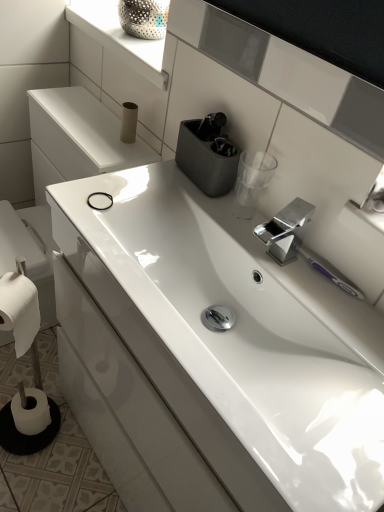
Where is `free location in front of matte cardboard toilet paper at upper center, the first toilet paper viewed from the right`? The image size is (384, 512). free location in front of matte cardboard toilet paper at upper center, the first toilet paper viewed from the right is located at coordinates (113, 152).